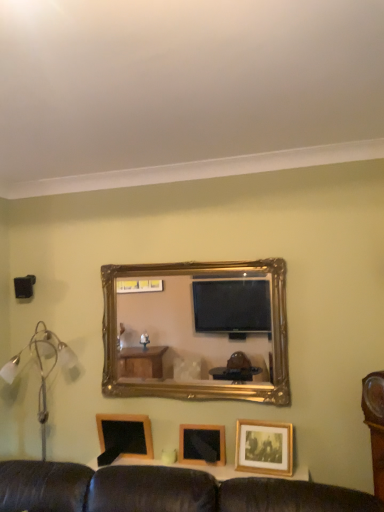
Question: Can you confirm if wooden picture frame at center, arranged as the second picture frame when viewed from the left, is bigger than gold/gilded mirror at center?

Choices:
 (A) no
 (B) yes

Answer: (A)

Question: From a real-world perspective, is wooden picture frame at center, which appears as the 2th picture frame when viewed from the right, over gold/gilded mirror at center?

Choices:
 (A) yes
 (B) no

Answer: (B)

Question: Considering the relative positions of wooden picture frame at center, arranged as the second picture frame when viewed from the left, and gold/gilded mirror at center in the image provided, is wooden picture frame at center, arranged as the second picture frame when viewed from the left, to the left of gold/gilded mirror at center from the viewer's perspective?

Choices:
 (A) no
 (B) yes

Answer: (A)

Question: Is gold/gilded mirror at center a part of wooden picture frame at center, which appears as the 2th picture frame when viewed from the right?

Choices:
 (A) no
 (B) yes

Answer: (A)

Question: Is wooden picture frame at center, which appears as the 2th picture frame when viewed from the right, to the right of gold/gilded mirror at center from the viewer's perspective?

Choices:
 (A) yes
 (B) no

Answer: (A)

Question: Is wooden picture frame at center, which appears as the 2th picture frame when viewed from the right, beside gold/gilded mirror at center?

Choices:
 (A) yes
 (B) no

Answer: (B)

Question: Does silver metallic floor lamp at left have a greater width compared to wooden picture frame at center, arranged as the second picture frame when viewed from the left?

Choices:
 (A) yes
 (B) no

Answer: (A)

Question: Is silver metallic floor lamp at left at the left side of wooden picture frame at center, arranged as the second picture frame when viewed from the left?

Choices:
 (A) yes
 (B) no

Answer: (A)

Question: Is silver metallic floor lamp at left outside of wooden picture frame at center, arranged as the second picture frame when viewed from the left?

Choices:
 (A) yes
 (B) no

Answer: (A)

Question: Is silver metallic floor lamp at left positioned far away from wooden picture frame at center, which appears as the 2th picture frame when viewed from the right?

Choices:
 (A) no
 (B) yes

Answer: (A)

Question: Is wooden picture frame at center, which appears as the 2th picture frame when viewed from the right, inside silver metallic floor lamp at left?

Choices:
 (A) yes
 (B) no

Answer: (B)

Question: Is silver metallic floor lamp at left taller than wooden picture frame at center, which appears as the 2th picture frame when viewed from the right?

Choices:
 (A) no
 (B) yes

Answer: (B)

Question: From the image's perspective, is silver metallic floor lamp at left on top of black plastic speaker at left?

Choices:
 (A) yes
 (B) no

Answer: (B)